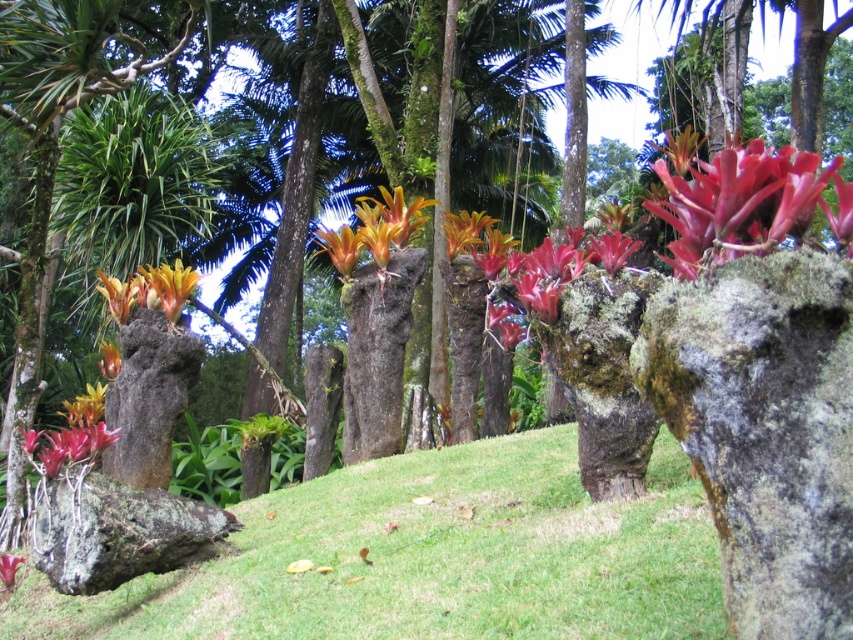
You are standing at the center of the tropical garden scene. You want to place a small potted plant exactly at the center of the garden. However, you must avoid placing it near any objects. The rough gray rock at lower left is located at coordinate point 0.831, 0.138. Is the center of the garden safe from any nearby objects?

The rough gray rock at lower left is located at coordinate point (117, 531), so placing the potted plant at the center of the garden would be far enough from the rough gray rock at lower left since the center is at point (426, 320).

You are standing in the tropical garden and want to take a photo of both the point at coordinates (779, 444) and the point at (227, 532). Which point is closer to your current position?

The point at coordinates (779, 444) is closer to the camera than the point at (227, 532), so it is closer to your current position.